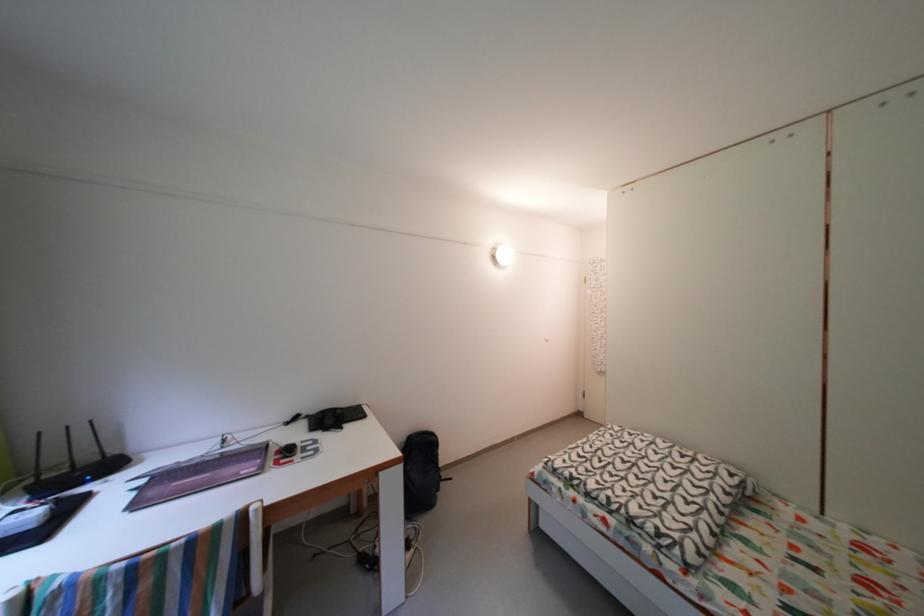
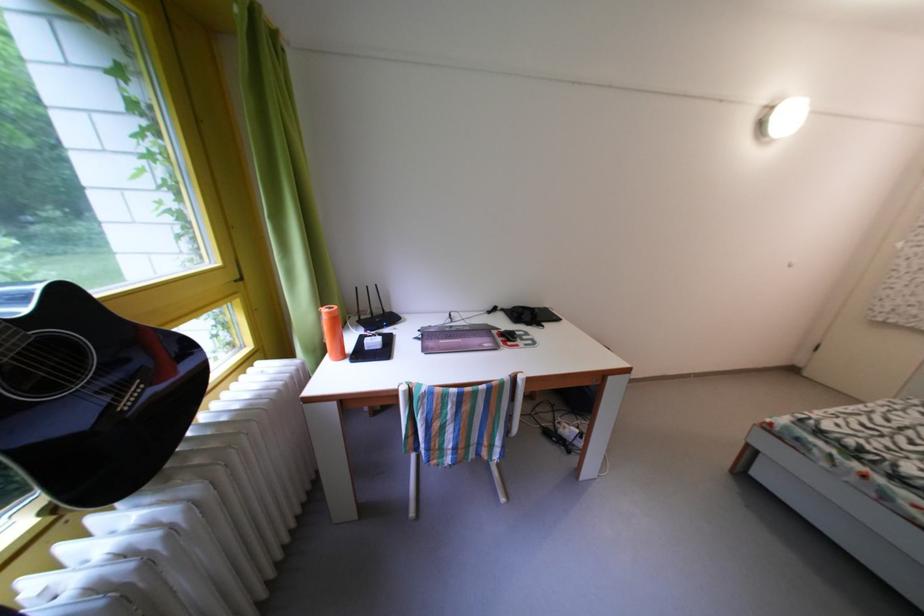
How did the camera likely rotate?

The camera's rotation is toward left-down.